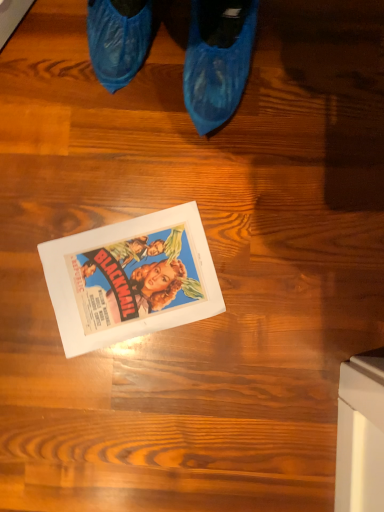
This screenshot has height=512, width=384. In order to click on matte white framed poster at center in this screenshot , I will do `click(131, 279)`.

In order to face matte white framed poster at center, should I rotate leftwards or rightwards?

Rotate your view left by about 8.061°.

The height and width of the screenshot is (512, 384). Describe the element at coordinates (131, 279) in the screenshot. I see `matte white framed poster at center` at that location.

Locate an element on the screen. Image resolution: width=384 pixels, height=512 pixels. matte white framed poster at center is located at coordinates (131, 279).